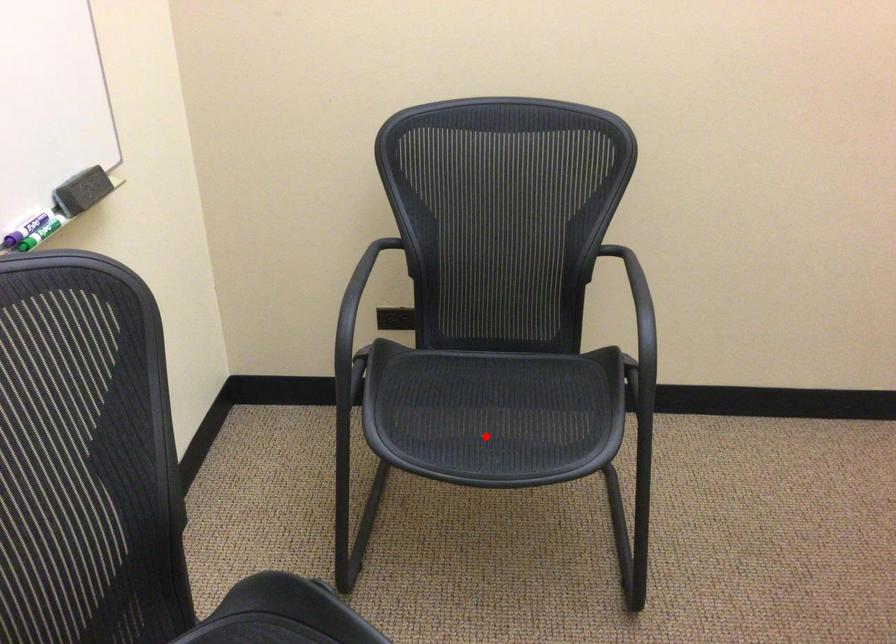
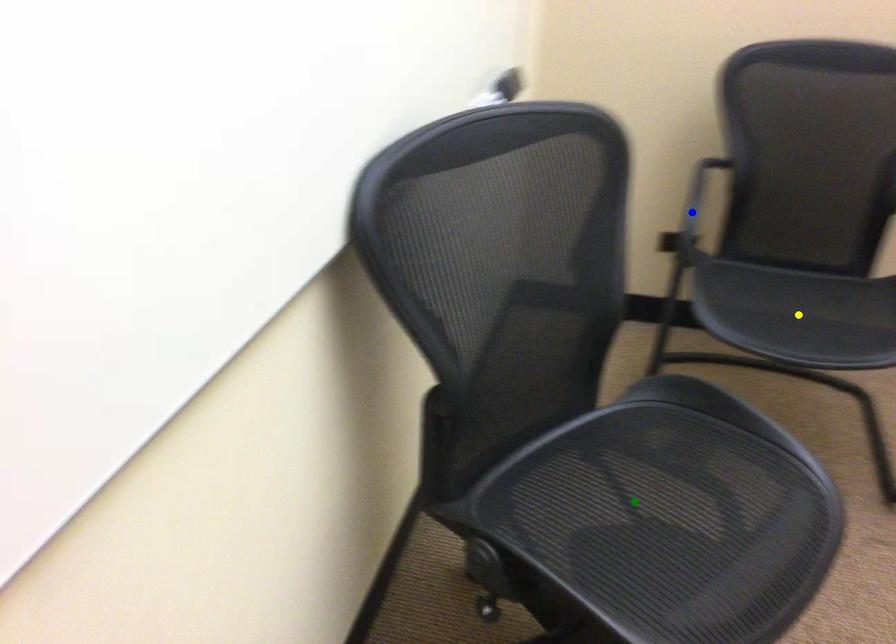
Question: I am providing you with two images of the same scene from different viewpoints. A red point is marked on the first image. You are given multiple points on the second image. Can you choose the point in image 2 that corresponds to the point in image 1?

Choices:
 (A) yellow point
 (B) green point
 (C) blue point

Answer: (A)